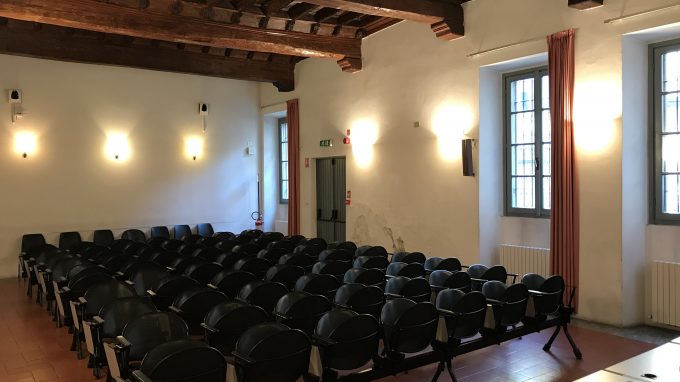
The height and width of the screenshot is (382, 680). Find the location of `light`. light is located at coordinates (436, 126).